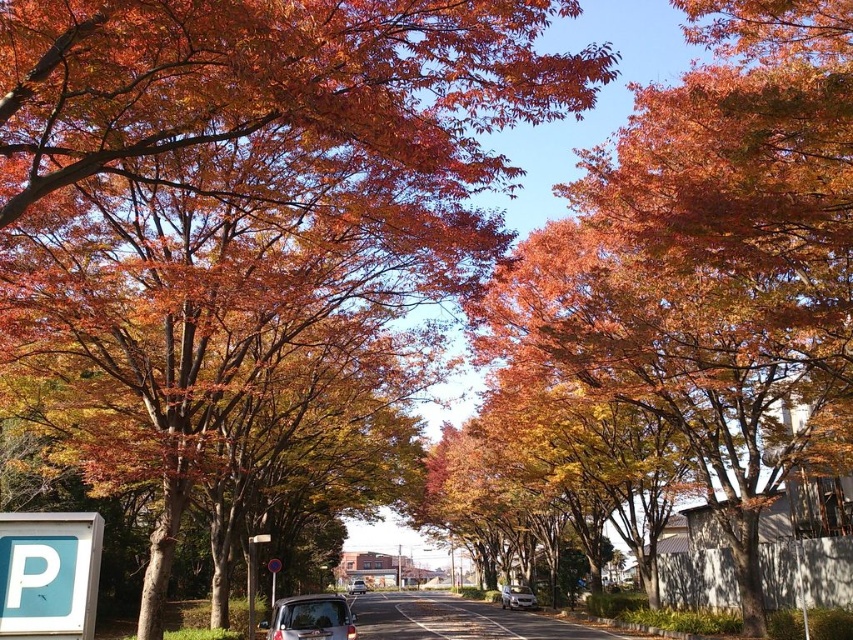
You are a pedestrian standing on the road and see the metallic silver minivan at center and the metallic reflective sign at center. Which object is higher from the ground?

The metallic silver minivan at center is higher from the ground than the metallic reflective sign at center according to the description.

You are standing at the entrance of the parking lot and want to locate the metallic silver minivan at center. According to the coordinates provided, where should you look relative to the parking sign?

The metallic silver minivan at center is located at coordinates point (311, 618), which means it is positioned to the right and slightly forward from the parking sign.